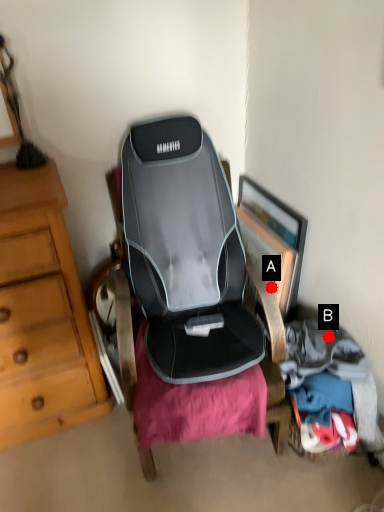
Question: Two points are circled on the image, labeled by A and B beside each circle. Which point is closer to the camera taking this photo?

Choices:
 (A) A is closer
 (B) B is closer

Answer: (B)